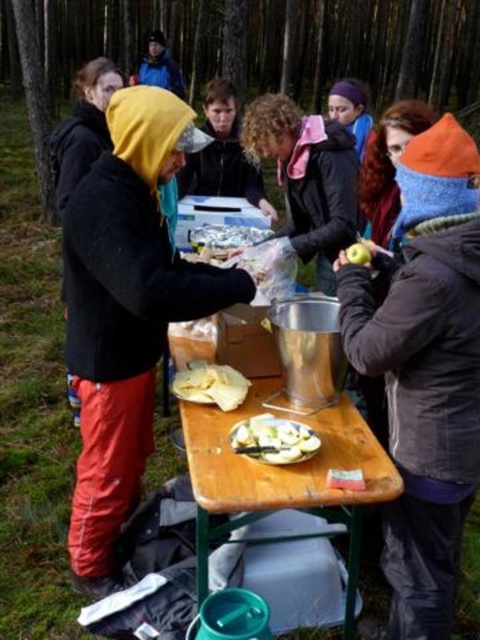
You are standing in the forest scene and want to pick up the orange knit hat at upper right and the white plastic bag at center. Which item do you need to walk towards first to reach the one closer to you?

The orange knit hat at upper right is closer to the viewer than the white plastic bag at center, so you should pick up the orange knit hat at upper right first.

What is located at the coordinates point (x=424, y=369)?

The orange knit hat at upper right is located at point (x=424, y=369).